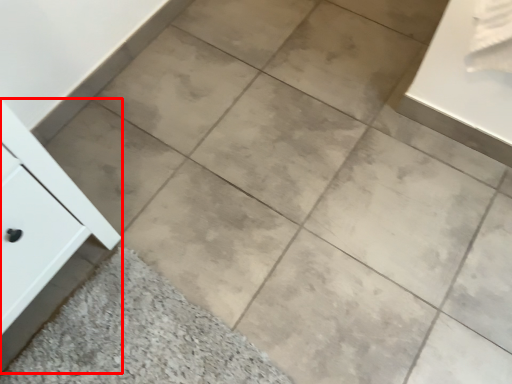
Question: Observing the image, what is the correct spatial positioning of cabinetry (annotated by the red box) in reference to ceramic tile?

Choices:
 (A) right
 (B) left

Answer: (B)